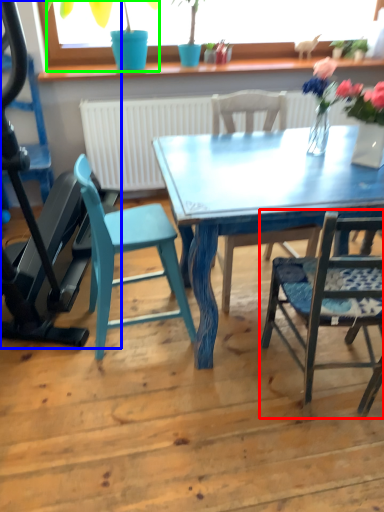
Question: Based on their relative distances, which object is nearer to chair (highlighted by a red box)? Choose from treadmill (highlighted by a blue box) and houseplant (highlighted by a green box).

Choices:
 (A) treadmill
 (B) houseplant

Answer: (A)